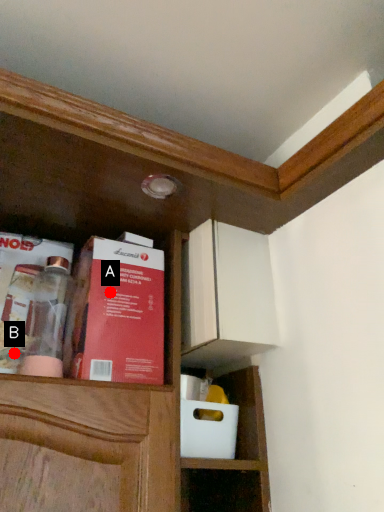
Question: Two points are circled on the image, labeled by A and B beside each circle. Which point is closer to the camera?

Choices:
 (A) A is closer
 (B) B is closer

Answer: (B)